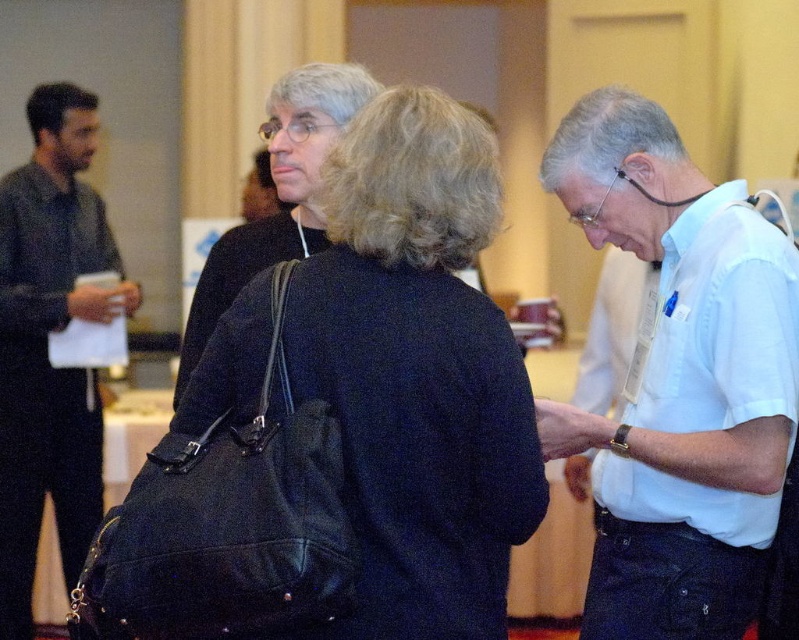
Question: Is black leather bag at center positioned before dark gray shirt at left?

Choices:
 (A) yes
 (B) no

Answer: (A)

Question: From the image, what is the correct spatial relationship of black leather bag at center in relation to dark gray shirt at left?

Choices:
 (A) above
 (B) below

Answer: (A)

Question: Which object is positioned farthest from the white cotton shirt at center?

Choices:
 (A) black leather bag at center
 (B) dark gray shirt at left

Answer: (B)

Question: Considering the real-world distances, which object is closest to the dark gray shirt at left?

Choices:
 (A) white cotton shirt at center
 (B) black leather bag at center

Answer: (B)

Question: Does white cotton shirt at center appear on the right side of dark gray shirt at left?

Choices:
 (A) yes
 (B) no

Answer: (A)

Question: Estimate the real-world distances between objects in this image. Which object is closer to the black leather bag at center?

Choices:
 (A) white cotton shirt at center
 (B) dark gray shirt at left

Answer: (A)